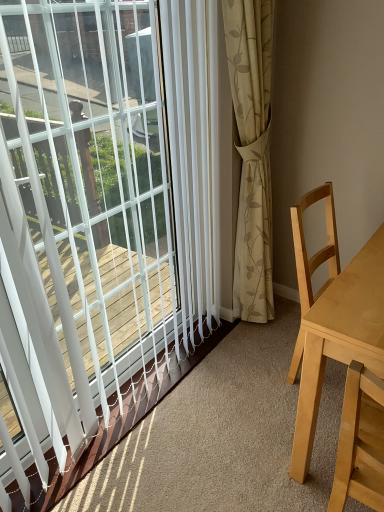
Question: From the image's perspective, is light wood table at right located above or below white plastic blinds at upper left?

Choices:
 (A) below
 (B) above

Answer: (A)

Question: In terms of height, does light wood table at right look taller or shorter compared to white plastic blinds at upper left?

Choices:
 (A) tall
 (B) short

Answer: (B)

Question: Is light wood table at right spatially inside white plastic blinds at upper left, or outside of it?

Choices:
 (A) inside
 (B) outside

Answer: (B)

Question: Based on their sizes in the image, would you say white plastic blinds at upper left is bigger or smaller than light wood table at right?

Choices:
 (A) small
 (B) big

Answer: (A)

Question: Does point (11, 55) appear closer or farther from the camera than point (297, 413)?

Choices:
 (A) farther
 (B) closer

Answer: (B)

Question: Considering the positions of white plastic blinds at upper left and light wood table at right in the image, is white plastic blinds at upper left wider or thinner than light wood table at right?

Choices:
 (A) wide
 (B) thin

Answer: (B)

Question: From a real-world perspective, is white plastic blinds at upper left physically located above or below light wood table at right?

Choices:
 (A) above
 (B) below

Answer: (A)